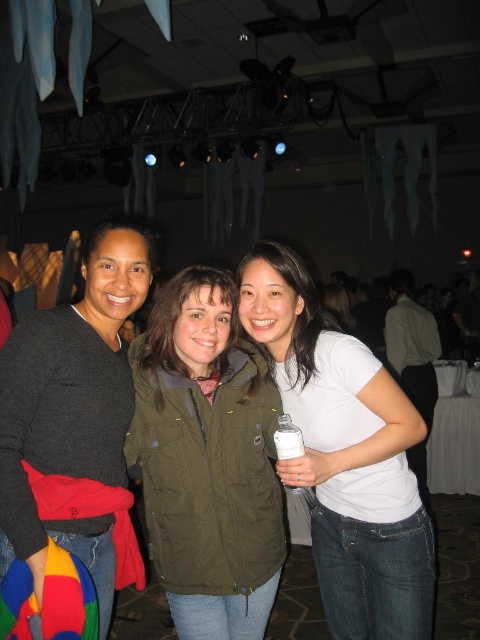
Who is taller, olive green jacket at center or white matte shirt at center?

With more height is white matte shirt at center.

Is point (164, 502) farther from viewer compared to point (324, 440)?

No.

The height and width of the screenshot is (640, 480). I want to click on olive green jacket at center, so click(206, 460).

Can you confirm if white matte shirt at center is positioned to the right of dark gray sweater at center?

Yes, white matte shirt at center is to the right of dark gray sweater at center.

Which is more to the right, white matte shirt at center or dark gray sweater at center?

white matte shirt at center

Does point (358, 438) come behind point (63, 460)?

Yes, it is behind point (63, 460).

Locate an element on the screen. This screenshot has height=640, width=480. white matte shirt at center is located at coordinates [346, 454].

Is olive green jacket at center above dark gray sweater at center?

No, olive green jacket at center is not above dark gray sweater at center.

Does olive green jacket at center have a larger size compared to dark gray sweater at center?

Actually, olive green jacket at center might be smaller than dark gray sweater at center.

Is point (168, 538) positioned behind point (52, 522)?

Yes, point (168, 538) is farther from viewer.

This screenshot has height=640, width=480. In order to click on olive green jacket at center in this screenshot , I will do `click(206, 460)`.